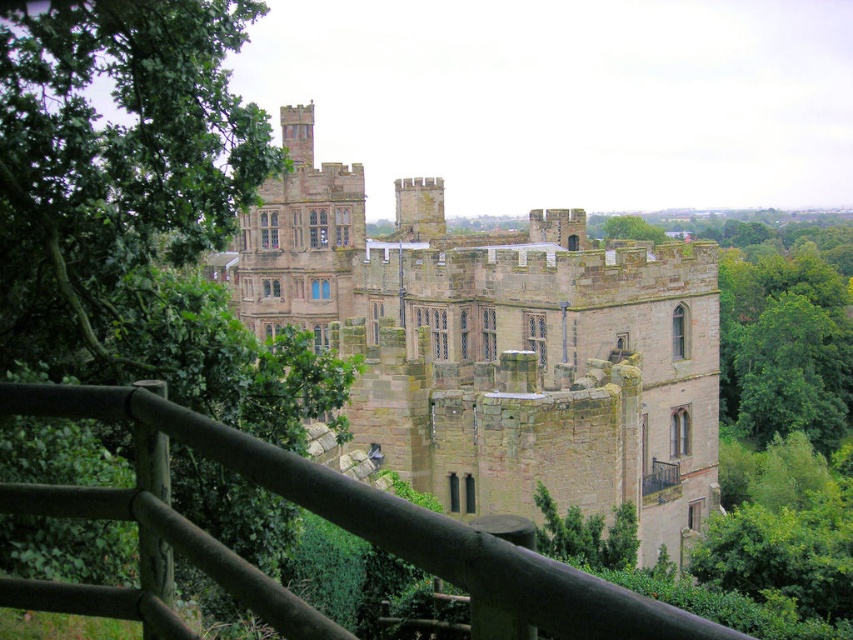
Question: Does brown wooden fence at lower center appear over green leafy tree at upper center?

Choices:
 (A) yes
 (B) no

Answer: (B)

Question: Is brown wooden fence at lower center thinner than green leafy tree at upper center?

Choices:
 (A) yes
 (B) no

Answer: (B)

Question: Estimate the real-world distances between objects in this image. Which object is closer to the brown stone castle at center?

Choices:
 (A) green leafy tree at upper center
 (B) green leafy tree at left

Answer: (B)

Question: Which point is farther from the camera taking this photo?

Choices:
 (A) click(556, 212)
 (B) click(199, 234)

Answer: (A)

Question: Which of the following is the farthest from the observer?

Choices:
 (A) (117, 0)
 (B) (618, 228)
 (C) (708, 272)
 (D) (289, 625)

Answer: (B)

Question: From the image, what is the correct spatial relationship of green leafy tree at left in relation to brown wooden fence at lower center?

Choices:
 (A) left
 (B) right

Answer: (A)